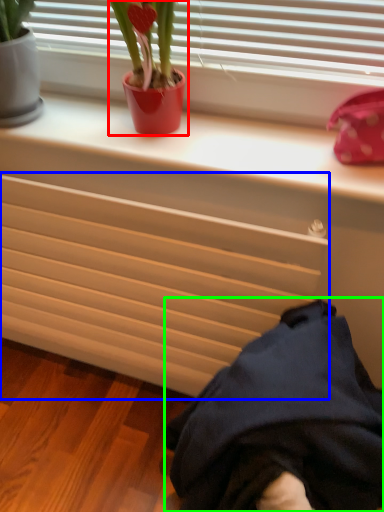
Question: Considering the real-world distances, which object is closest to houseplant (highlighted by a red box)? radiator (highlighted by a blue box) or clothing (highlighted by a green box).

Choices:
 (A) radiator
 (B) clothing

Answer: (A)